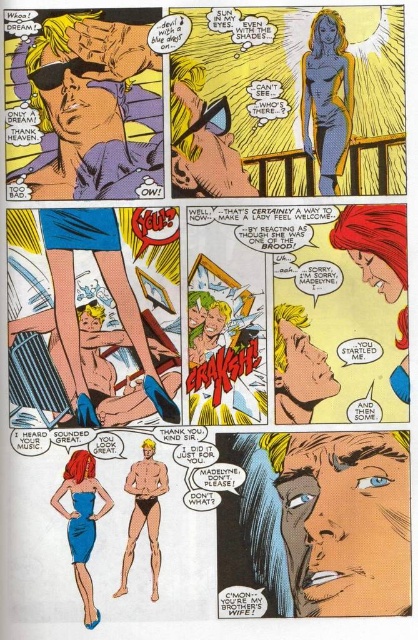
In the comic panel, you notice two characters with different skin tones. The man with the smooth skin face at center and the woman with smooth tan skin at lower center. Which character is positioned to the right of the other?

The smooth skin face at center is positioned on the right side of smooth tan skin at lower center, so the man with the smooth skin face at center is to the right of the woman with smooth tan skin at lower center.

What object is located at the point with coordinates [101,323] in the image?

The smooth blue shorts at lower left are located at point [101,323].

Based on the comic panel description, which object is positioned lower in the image? The smooth skin face at center or the smooth tan skin at lower center?

The smooth skin face at center is positioned lower than the smooth tan skin at lower center.